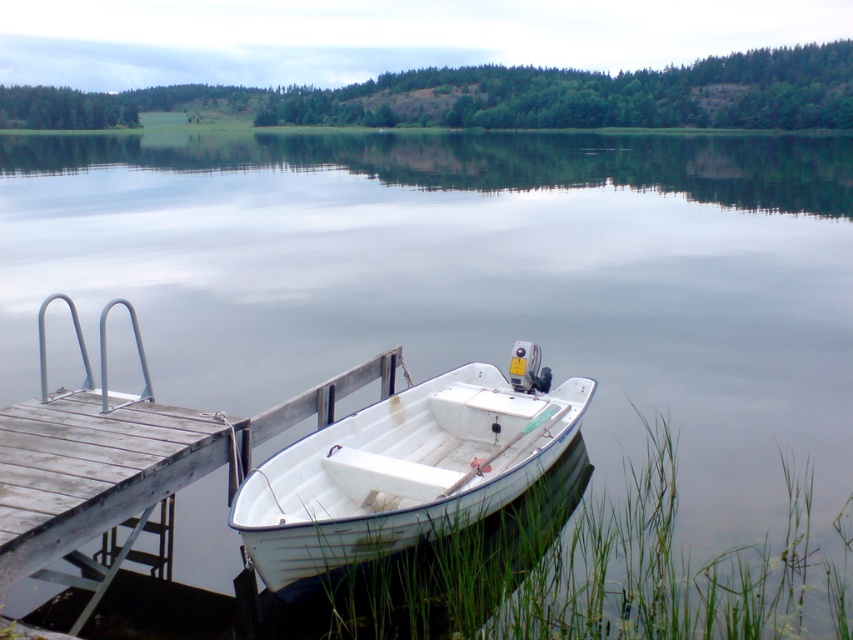
You are standing on the wooden dock and see the point marked at coordinates (404, 468). What object is located at that point?

The white matte boat at lower center is located at the point marked at coordinates (404, 468).

You are standing on the dock and see two points marked on the water. The first point is at coordinates point [483,492] and the second point is at point [390,364]. Which point is closer to you?

Point [483,492] is in front of point [390,364], so the first point is closer to you.